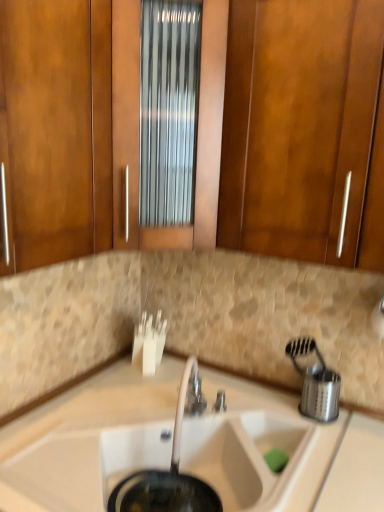
Question: From the image's perspective, is white matte sink at center above or below silver metallic faucet at center?

Choices:
 (A) above
 (B) below

Answer: (B)

Question: Is white matte sink at center to the left or to the right of silver metallic faucet at center in the image?

Choices:
 (A) left
 (B) right

Answer: (A)

Question: Which is nearer to the silver metallic faucet at center?

Choices:
 (A) white ceramic faucet at center
 (B) matte wood cabinet at upper center, which appears as the 1th cabinetry when viewed from the left
 (C) stainless steel strainer at right
 (D) wooden cabinet at center, the second cabinetry in the left-to-right sequence
 (E) white matte sink at center

Answer: (A)

Question: Which object is positioned closest to the white matte sink at center?

Choices:
 (A) wooden cabinet at center, the second cabinetry in the left-to-right sequence
 (B) matte wood cabinet at upper center, placed as the 2th cabinetry when sorted from right to left
 (C) silver metallic faucet at center
 (D) white ceramic faucet at center
 (E) white matte sink at center

Answer: (D)